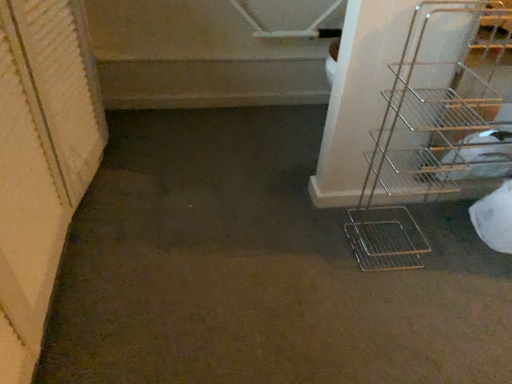
Question: Would you consider smooth concrete stairs at upper left to be distant from metallic wire rack at right?

Choices:
 (A) no
 (B) yes

Answer: (A)

Question: Is smooth concrete stairs at upper left at the left side of metallic wire rack at right?

Choices:
 (A) yes
 (B) no

Answer: (A)

Question: Can you confirm if smooth concrete stairs at upper left is bigger than metallic wire rack at right?

Choices:
 (A) yes
 (B) no

Answer: (A)

Question: From a real-world perspective, is smooth concrete stairs at upper left located higher than metallic wire rack at right?

Choices:
 (A) yes
 (B) no

Answer: (B)

Question: Considering the relative positions of smooth concrete stairs at upper left and metallic wire rack at right in the image provided, is smooth concrete stairs at upper left to the right of metallic wire rack at right from the viewer's perspective?

Choices:
 (A) no
 (B) yes

Answer: (A)

Question: Does smooth concrete stairs at upper left have a greater height compared to metallic wire rack at right?

Choices:
 (A) no
 (B) yes

Answer: (A)

Question: Does metallic wire rack at right turn towards smooth concrete stairs at upper left?

Choices:
 (A) no
 (B) yes

Answer: (A)

Question: Considering the relative sizes of metallic wire rack at right and smooth concrete stairs at upper left in the image provided, is metallic wire rack at right smaller than smooth concrete stairs at upper left?

Choices:
 (A) yes
 (B) no

Answer: (A)

Question: From a real-world perspective, is metallic wire rack at right over smooth concrete stairs at upper left?

Choices:
 (A) yes
 (B) no

Answer: (A)

Question: Is metallic wire rack at right behind smooth concrete stairs at upper left?

Choices:
 (A) no
 (B) yes

Answer: (A)

Question: Is metallic wire rack at right bigger than smooth concrete stairs at upper left?

Choices:
 (A) no
 (B) yes

Answer: (A)

Question: Is smooth concrete stairs at upper left a part of metallic wire rack at right?

Choices:
 (A) yes
 (B) no

Answer: (B)

Question: Considering the positions of point (246, 67) and point (392, 263), is point (246, 67) closer or farther from the camera than point (392, 263)?

Choices:
 (A) farther
 (B) closer

Answer: (A)